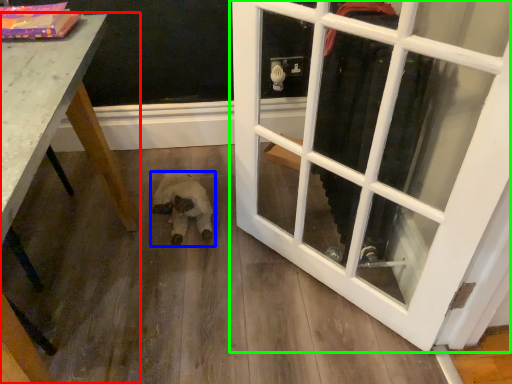
Question: Based on their relative distances, which object is farther from table (highlighted by a red box)? Choose from animal (highlighted by a blue box) and door (highlighted by a green box).

Choices:
 (A) animal
 (B) door

Answer: (B)